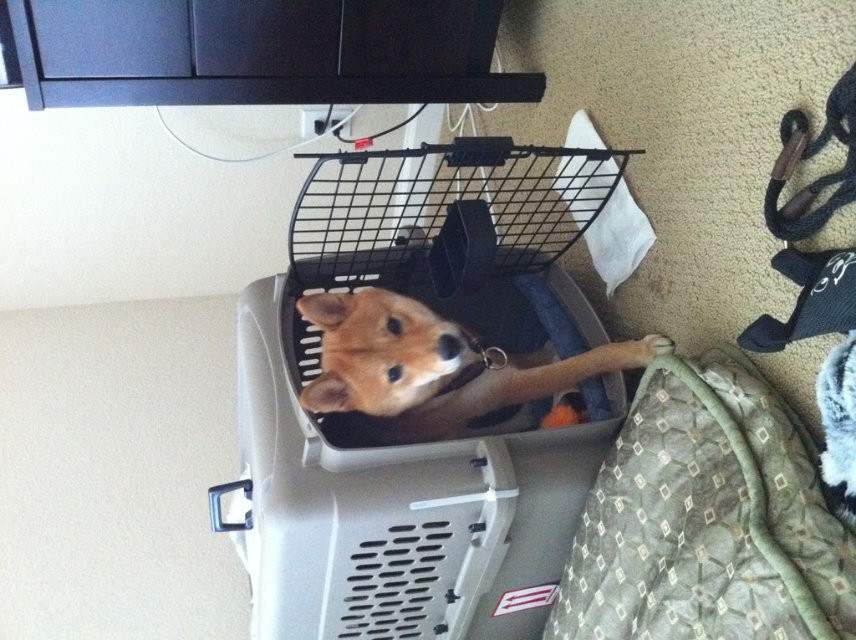
Question: Is green quilted dog bed at lower right to the right of golden fur dog at center from the viewer's perspective?

Choices:
 (A) yes
 (B) no

Answer: (A)

Question: Does green quilted dog bed at lower right have a lesser width compared to golden fur dog at center?

Choices:
 (A) no
 (B) yes

Answer: (B)

Question: Does green quilted dog bed at lower right have a larger size compared to golden fur dog at center?

Choices:
 (A) no
 (B) yes

Answer: (B)

Question: Which point is closer to the camera?

Choices:
 (A) green quilted dog bed at lower right
 (B) golden fur dog at center

Answer: (A)